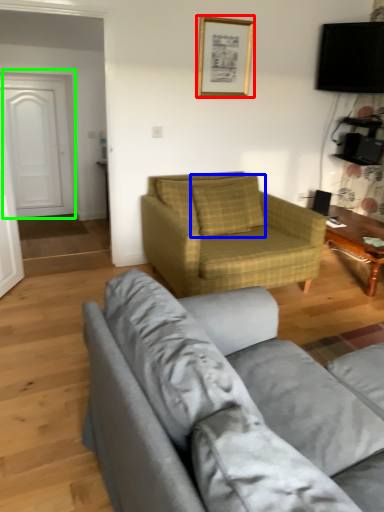
Question: Which object is positioned closest to picture frame (highlighted by a red box)? Select from pillow (highlighted by a blue box) and door (highlighted by a green box).

Choices:
 (A) pillow
 (B) door

Answer: (A)